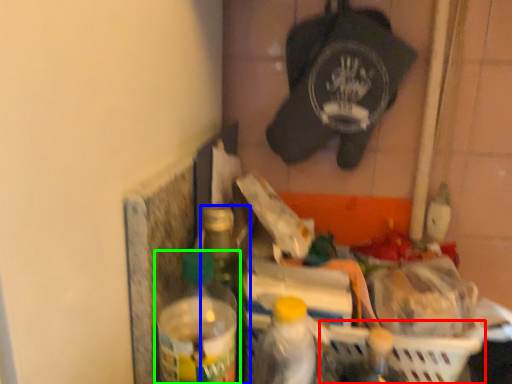
Question: Which object is positioned farthest from basket (highlighted by a red box)? Select from bottle (highlighted by a blue box) and bottle (highlighted by a green box).

Choices:
 (A) bottle
 (B) bottle

Answer: (B)